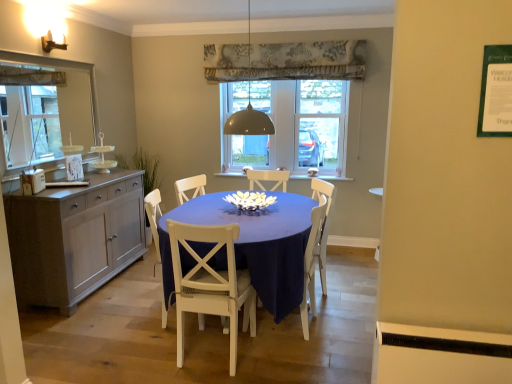
Describe the element at coordinates (321, 123) in the screenshot. I see `transparent glass door at center, marked as the second glass door in a left-to-right arrangement` at that location.

What do you see at coordinates (154, 220) in the screenshot? I see `white wood chair at center, the 1th chair positioned from the left` at bounding box center [154, 220].

In order to click on white wood chair at center, which ranks as the third chair in right-to-left order in this screenshot , I will do `click(154, 220)`.

This screenshot has height=384, width=512. Describe the element at coordinates (74, 168) in the screenshot. I see `wooden picture frame at left` at that location.

The height and width of the screenshot is (384, 512). Identify the location of matte white table at center. (253, 245).

Describe the element at coordinates (211, 283) in the screenshot. The width and height of the screenshot is (512, 384). I see `white wood chair at center, arranged as the 2th chair when viewed from the right` at that location.

Identify the location of matte glass mirror at left. (45, 110).

What do you see at coordinates (312, 262) in the screenshot? Image resolution: width=512 pixels, height=384 pixels. I see `white wood chair at center, positioned as the 1th chair in right-to-left order` at bounding box center [312, 262].

I want to click on transparent glass door at center, marked as the second glass door in a left-to-right arrangement, so click(321, 123).

Does transparent glass door at center, marked as the second glass door in a left-to-right arrangement, have a smaller size compared to matte gray dome at center?

Indeed, transparent glass door at center, marked as the second glass door in a left-to-right arrangement, has a smaller size compared to matte gray dome at center.

Does transparent glass door at center, marked as the second glass door in a left-to-right arrangement, have a lesser height compared to matte gray dome at center?

In fact, transparent glass door at center, marked as the second glass door in a left-to-right arrangement, may be taller than matte gray dome at center.

From the image's perspective, is transparent glass door at center, the 1th glass door viewed from the right, above matte gray dome at center?

Actually, transparent glass door at center, the 1th glass door viewed from the right, appears below matte gray dome at center in the image.

Which object is further away from the camera, transparent glass door at center, marked as the second glass door in a left-to-right arrangement, or matte gray dome at center?

transparent glass door at center, marked as the second glass door in a left-to-right arrangement, is further from the camera.

From the image's perspective, which one is positioned higher, matte gray cabinet at left or wooden picture frame at left?

wooden picture frame at left is shown above in the image.

How many degrees apart are the facing directions of matte gray cabinet at left and wooden picture frame at left?

They differ by 2.64 degrees in their facing directions.

Is matte gray cabinet at left completely or partially outside of wooden picture frame at left?

matte gray cabinet at left lies outside wooden picture frame at left's area.

Does white wood chair at center, which is the 3th chair in left-to-right order, have a greater height compared to matte glass mirror at left?

In fact, white wood chair at center, which is the 3th chair in left-to-right order, may be shorter than matte glass mirror at left.

Could you tell me if white wood chair at center, positioned as the 1th chair in right-to-left order, is turned towards matte glass mirror at left?

Yes, white wood chair at center, positioned as the 1th chair in right-to-left order, is facing matte glass mirror at left.

From the image's perspective, is white wood chair at center, which is the 3th chair in left-to-right order, on top of matte glass mirror at left?

No, from the image's perspective, white wood chair at center, which is the 3th chair in left-to-right order, is not above matte glass mirror at left.

From a real-world perspective, is white wood chair at center, which is the 3th chair in left-to-right order, located beneath matte glass mirror at left?

Yes, from a real-world perspective, white wood chair at center, which is the 3th chair in left-to-right order, is under matte glass mirror at left.

Can we say matte glass mirror at left lies outside white wood chair at center, which is the 3th chair in left-to-right order?

matte glass mirror at left lies outside white wood chair at center, which is the 3th chair in left-to-right order,'s area.

Between matte glass mirror at left and white wood chair at center, positioned as the 1th chair in right-to-left order, which one has larger width?

white wood chair at center, positioned as the 1th chair in right-to-left order, is wider.

Where is `mirror behind the white wood chair at center, which is the 3th chair in left-to-right order`? mirror behind the white wood chair at center, which is the 3th chair in left-to-right order is located at coordinates (45, 110).

Which of these two, matte glass mirror at left or white wood chair at center, which is the 3th chair in left-to-right order, is smaller?

With smaller size is matte glass mirror at left.

From the picture: Is matte glass mirror at left not near matte gray cabinet at left?

matte glass mirror at left is actually quite close to matte gray cabinet at left.

Considering the positions of points (22, 71) and (108, 195), is point (22, 71) closer to camera compared to point (108, 195)?

Yes, point (22, 71) is closer to viewer.

Is matte glass mirror at left facing away from matte gray cabinet at left?

That's not correct — matte glass mirror at left is not looking away from matte gray cabinet at left.

Considering their positions, is matte glass mirror at left located in front of or behind matte gray cabinet at left?

Clearly, matte glass mirror at left is in front of matte gray cabinet at left.

Locate an element on the screen. Image resolution: width=512 pixels, height=384 pixels. lamp on the right of white wood chair at center, which ranks as the third chair in right-to-left order is located at coordinates (249, 109).

Which object is positioned more to the left, white wood chair at center, which ranks as the third chair in right-to-left order, or matte gray dome at center?

white wood chair at center, which ranks as the third chair in right-to-left order, is more to the left.

Is white wood chair at center, the 1th chair positioned from the left, bigger than matte gray dome at center?

Actually, white wood chair at center, the 1th chair positioned from the left, might be smaller than matte gray dome at center.

From the image's perspective, between white wood chair at center, which ranks as the third chair in right-to-left order, and matte gray dome at center, which one is located above?

matte gray dome at center, from the image's perspective.

Does matte gray dome at center have a greater width compared to clear glass door at center, which appears as the first glass door when viewed from the left?

Yes.

Is matte gray dome at center inside or outside of clear glass door at center, which is the 2th glass door from right to left?

matte gray dome at center is outside clear glass door at center, which is the 2th glass door from right to left.

Is matte gray dome at center aimed at clear glass door at center, which appears as the first glass door when viewed from the left?

No, matte gray dome at center does not turn towards clear glass door at center, which appears as the first glass door when viewed from the left.

Where is `lamp above the transparent glass door at center, marked as the second glass door in a left-to-right arrangement (from a real-world perspective)`? The width and height of the screenshot is (512, 384). lamp above the transparent glass door at center, marked as the second glass door in a left-to-right arrangement (from a real-world perspective) is located at coordinates (249, 109).

This screenshot has width=512, height=384. In the image, there is a wooden picture frame at left. In order to click on cabinetry below it (from the image's perspective) in this screenshot , I will do `click(74, 238)`.

Considering their positions, is white wood chair at center, arranged as the 2th chair when viewed from the right, positioned further to white wood chair at center, which ranks as the third chair in right-to-left order, than transparent glass door at center, the 1th glass door viewed from the right?

transparent glass door at center, the 1th glass door viewed from the right.

Which object lies nearer to the anchor point matte gray dome at center, matte glass mirror at left or white wood chair at center, which is the 3th chair in left-to-right order?

white wood chair at center, which is the 3th chair in left-to-right order, is closer to matte gray dome at center.

Estimate the real-world distances between objects in this image. Which object is closer to matte white table at center, white wood chair at center, the 1th chair positioned from the left, or matte glass mirror at left?

white wood chair at center, the 1th chair positioned from the left, is positioned closer to the anchor matte white table at center.

Estimate the real-world distances between objects in this image. Which object is further from matte gray cabinet at left, matte glass mirror at left or clear glass door at center, which is the 2th glass door from right to left?

clear glass door at center, which is the 2th glass door from right to left.

Estimate the real-world distances between objects in this image. Which object is further from white wood chair at center, arranged as the 2th chair when viewed from the right, white wood chair at center, which is the 3th chair in left-to-right order, or clear glass door at center, which appears as the first glass door when viewed from the left?

clear glass door at center, which appears as the first glass door when viewed from the left, lies further to white wood chair at center, arranged as the 2th chair when viewed from the right, than the other object.

Based on their spatial positions, is matte gray dome at center or clear glass door at center, which appears as the first glass door when viewed from the left, closer to matte glass mirror at left?

matte gray dome at center.

Based on their spatial positions, is wooden picture frame at left or matte glass mirror at left closer to matte white table at center?

wooden picture frame at left.

When comparing their distances from wooden picture frame at left, does matte gray dome at center or matte gray cabinet at left seem closer?

matte gray cabinet at left is positioned closer to the anchor wooden picture frame at left.

The width and height of the screenshot is (512, 384). I want to click on glass door between white wood chair at center, arranged as the 2th chair when viewed from the right, and clear glass door at center, which is the 2th glass door from right to left, along the z-axis, so click(x=321, y=123).

Locate an element on the screen. glass door located between white wood chair at center, positioned as the 1th chair in right-to-left order, and clear glass door at center, which is the 2th glass door from right to left, in the depth direction is located at coordinates (321, 123).

Locate an element on the screen. cabinetry between matte glass mirror at left and matte gray dome at center is located at coordinates (74, 238).

The image size is (512, 384). What are the coordinates of `lamp between wooden picture frame at left and white wood chair at center, positioned as the 1th chair in right-to-left order, from left to right` in the screenshot? It's located at (249, 109).